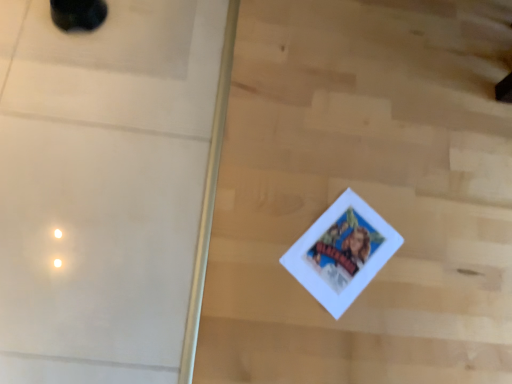
Locate an element on the screen. free space above white glossy screen door at upper left (from a real-world perspective) is located at coordinates (80, 178).